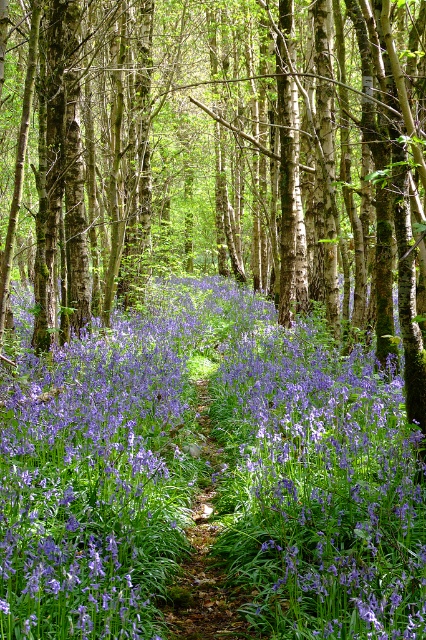
Question: Among these points, which one is nearest to the camera?

Choices:
 (A) (247, 632)
 (B) (368, 16)
 (C) (81, 496)

Answer: (A)

Question: Which of these objects is positioned farthest from the green leafy trail at center?

Choices:
 (A) purple matte flower at center
 (B) purple flowerbed at center

Answer: (B)

Question: Observing the image, what is the correct spatial positioning of purple matte flower at center in reference to green leafy trail at center?

Choices:
 (A) below
 (B) above

Answer: (B)

Question: Can you confirm if purple flowerbed at center is bigger than purple matte flower at center?

Choices:
 (A) no
 (B) yes

Answer: (B)

Question: Which point is farther from the camera taking this photo?

Choices:
 (A) (209, 378)
 (B) (337, 292)

Answer: (A)

Question: Can you confirm if purple flowerbed at center is positioned to the right of purple matte flower at center?

Choices:
 (A) yes
 (B) no

Answer: (B)